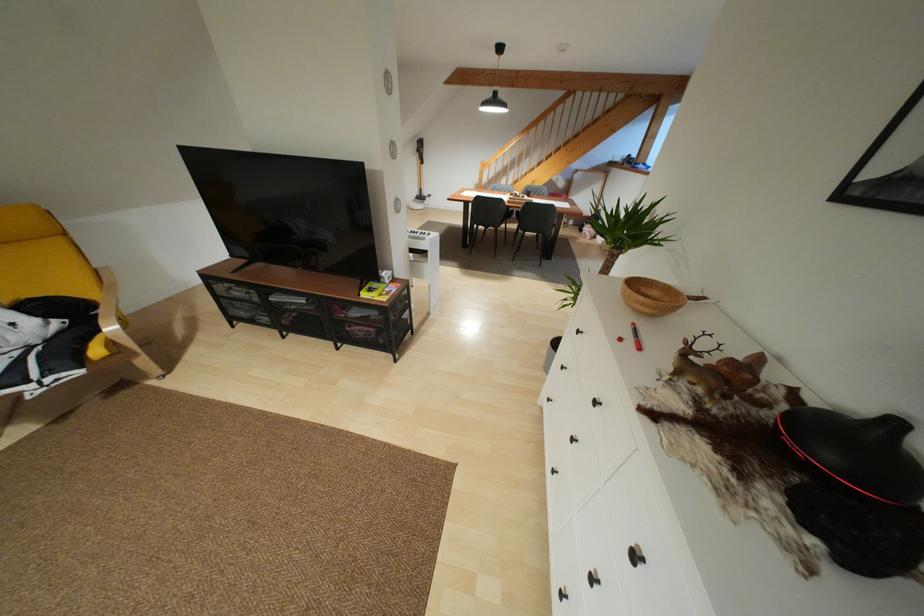
Where would you lift the wooden bowl? Please return your answer as a coordinate pair (x, y).

(650, 296)